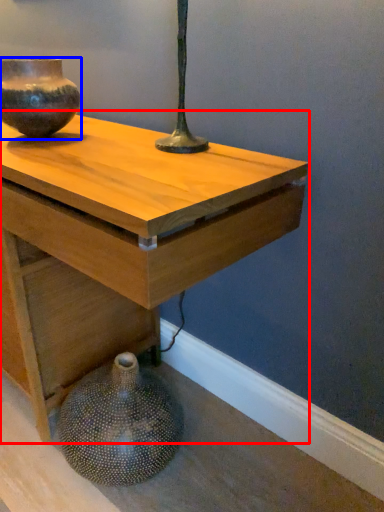
Question: Which point is further to the camera, table (highlighted by a red box) or vase (highlighted by a blue box)?

Choices:
 (A) table
 (B) vase

Answer: (B)